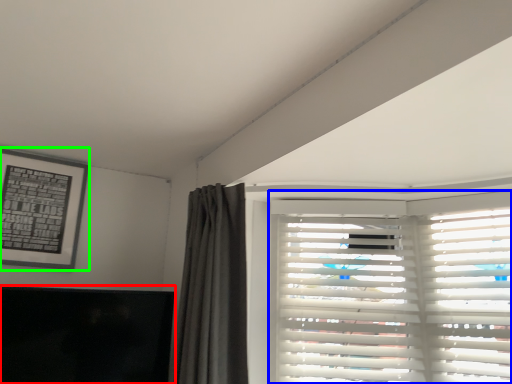
Question: Which object is positioned closest to window screen (highlighted by a red box)? Select from window blind (highlighted by a blue box) and picture frame (highlighted by a green box).

Choices:
 (A) window blind
 (B) picture frame

Answer: (B)